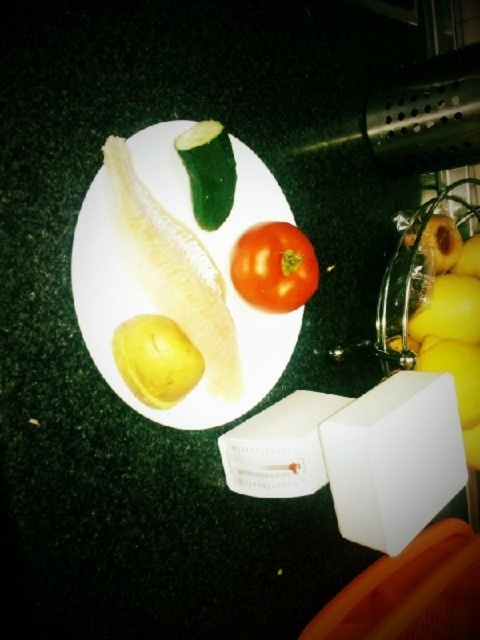
You are a chef preparing a fruit salad and need to place the yellow matte bananas at right and the yellow matte potato at center onto the kitchen scale to weigh them. However, the scale can only hold one item at a time. Which item should you place on the scale first to ensure the correct weight measurement?

The yellow matte bananas at right should be placed on the scale first because it is positioned over the yellow matte potato at center, meaning it is closer to the scale and easier to reach.

You are preparing a fruit salad and need to place the yellow matte bananas at right and the red matte tomato at center into a bowl. Based on their positions in the image, which object is closer to the edge of the countertop?

The yellow matte bananas at right is closer to the edge of the countertop because it is positioned below the red matte tomato at center, which implies it is lower on the image and thus nearer to the edge.

You are arranging fruits on a kitchen counter. You have a red matte tomato at center and yellow matte bananas at right. If you want to move the tomato closer to the bananas, which direction should you move it?

Since the red matte tomato at center is behind the yellow matte bananas at right, you should move it forward towards the bananas to bring them closer.